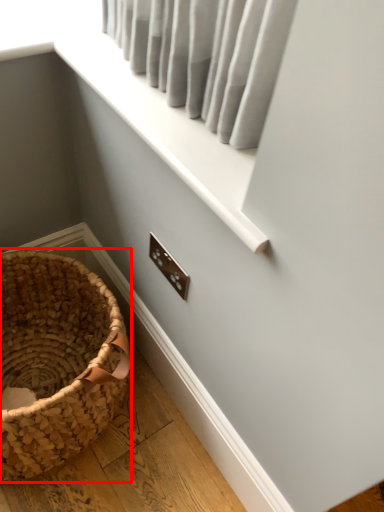
Question: From the image, what is the correct spatial relationship of picnic basket (annotated by the red box) in relation to window frame?

Choices:
 (A) right
 (B) left

Answer: (B)